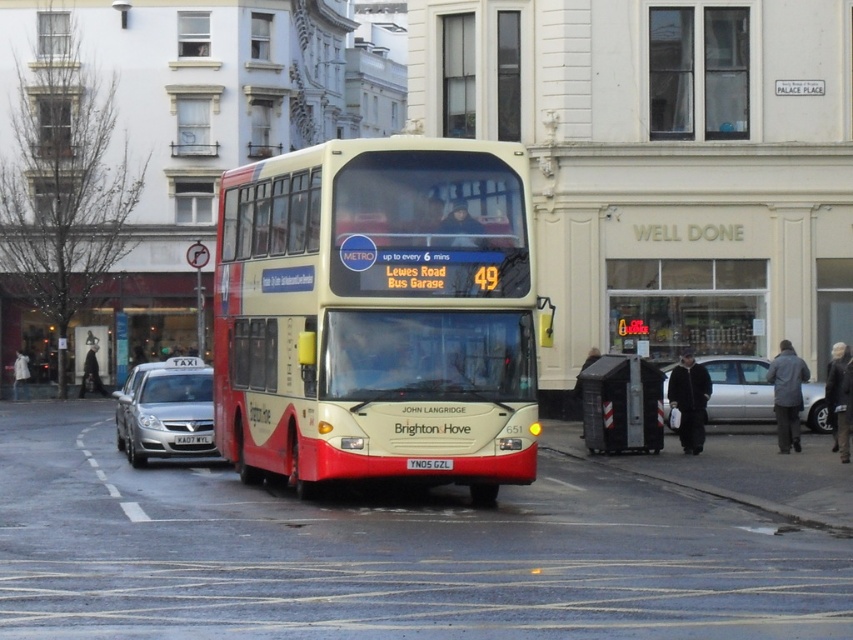
Question: Based on their relative distances, which object is nearer to the silver metallic taxi at left?

Choices:
 (A) silver metallic sedan at center
 (B) metallic gray bus stop at lower right

Answer: (B)

Question: Estimate the real-world distances between objects in this image. Which object is closer to the metallic gray bus stop at lower right?

Choices:
 (A) silver metallic taxi at left
 (B) silver metallic sedan at center
 (C) white plastic license plate at center
 (D) matte white and red bus at center

Answer: (B)

Question: Which object appears closest to the camera in this image?

Choices:
 (A) silver metallic sedan at center
 (B) yellow metallic license plate at center
 (C) matte white and red bus at center

Answer: (C)

Question: Is the position of matte white and red bus at center less distant than that of silver metallic sedan at center?

Choices:
 (A) no
 (B) yes

Answer: (B)

Question: Does metallic gray bus stop at lower right come behind silver metallic sedan at center?

Choices:
 (A) no
 (B) yes

Answer: (A)

Question: Does matte white and red bus at center have a smaller size compared to yellow metallic license plate at center?

Choices:
 (A) yes
 (B) no

Answer: (B)